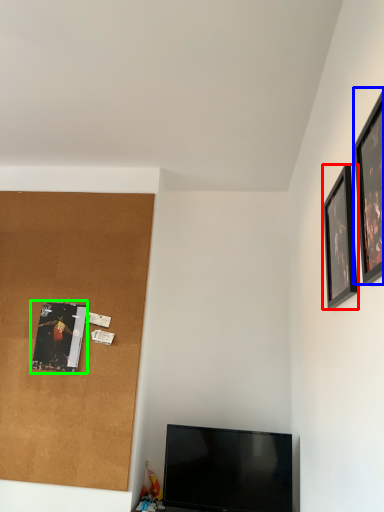
Question: Which object is the farthest from picture frame (highlighted by a red box)? Choose among these: picture frame (highlighted by a blue box) or picture frame (highlighted by a green box).

Choices:
 (A) picture frame
 (B) picture frame

Answer: (B)